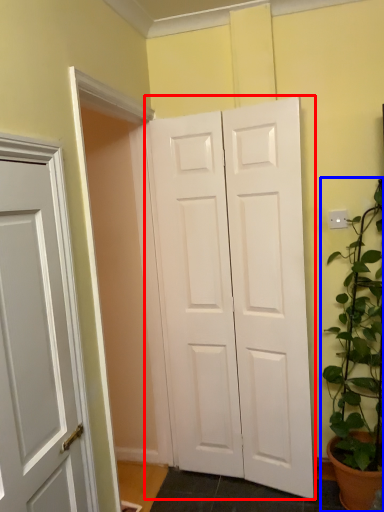
Question: Among these objects, which one is farthest to the camera, door (highlighted by a red box) or houseplant (highlighted by a blue box)?

Choices:
 (A) door
 (B) houseplant

Answer: (A)